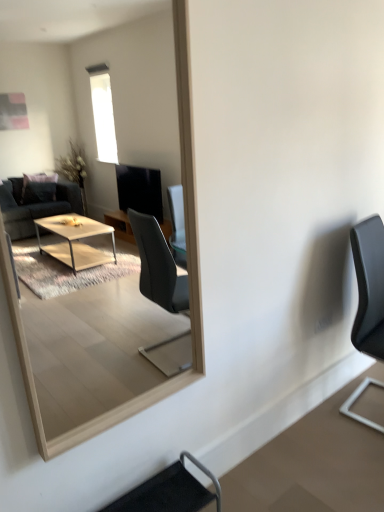
Identify the location of free spot to the left of black matte chair at right, the 2th chair positioned from the bottom. The image size is (384, 512). (321, 423).